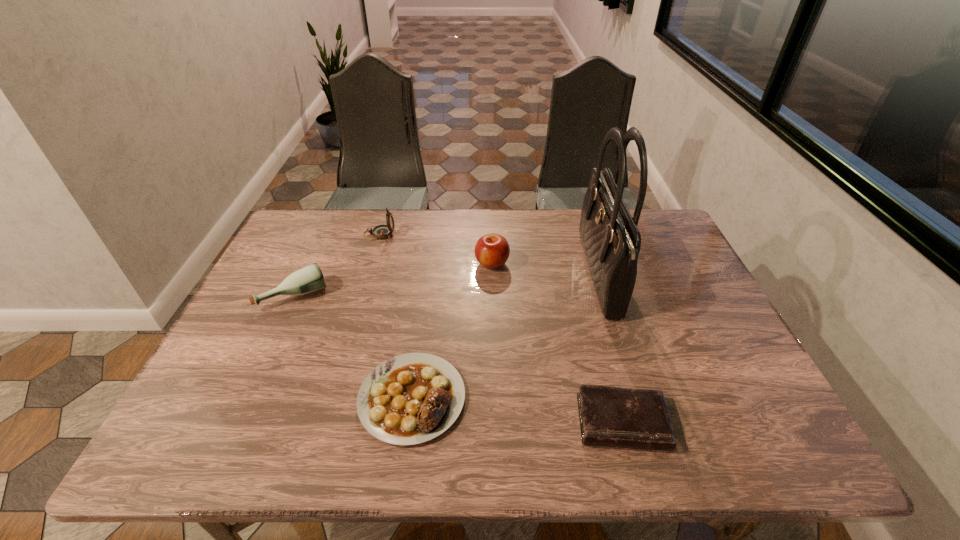
You are a GUI agent. You are given a task and a screenshot of the screen. Output one action in this format:
    pyautogui.click(x=<x>, y=<y>)
    Task: Click on the diary that is at the near edge
    
    Given the screenshot: What is the action you would take?
    pyautogui.click(x=609, y=416)

This screenshot has height=540, width=960. What are the coordinates of `object situated at the left edge` in the screenshot? It's located at [309, 279].

Image resolution: width=960 pixels, height=540 pixels. I want to click on free region at the far edge of the desktop, so click(381, 248).

The width and height of the screenshot is (960, 540). Find the location of `free location at the near edge of the desktop`. free location at the near edge of the desktop is located at coordinates (545, 425).

Where is `vacant space at the left edge of the desktop`? The height and width of the screenshot is (540, 960). vacant space at the left edge of the desktop is located at coordinates (207, 395).

I want to click on vacant space at the right edge of the desktop, so click(683, 318).

Locate an element on the screen. Image resolution: width=960 pixels, height=540 pixels. vacant space at the far left corner is located at coordinates click(x=335, y=212).

I want to click on empty space between the leftmost object and the apple, so click(x=394, y=279).

You are a GUI agent. You are given a task and a screenshot of the screen. Output one action in this format:
    pyautogui.click(x=<x>, y=<y>)
    Task: Click on the vacant point located between the fifth object from right to left and the apple
    Image resolution: width=960 pixels, height=540 pixels.
    Given the screenshot: What is the action you would take?
    pyautogui.click(x=436, y=249)

I want to click on vacant area that lies between the fifth tallest object and the apple, so click(x=452, y=330).